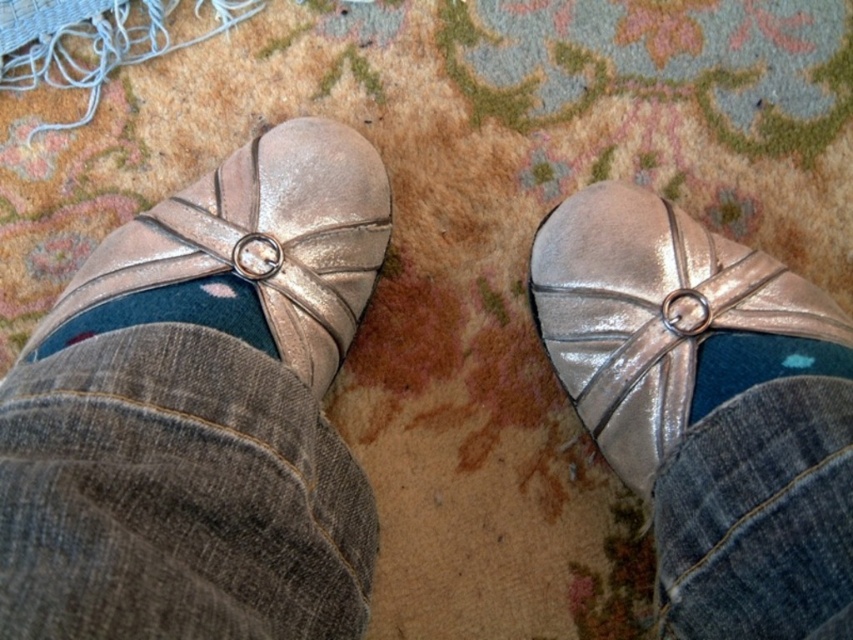
Question: Is shiny metallic shoe at center thinner than metallic leather shoe at left?

Choices:
 (A) no
 (B) yes

Answer: (B)

Question: Which object is the farthest from the blue denim sock at right?

Choices:
 (A) metallic leather shoe at left
 (B) blue soft sock at lower left

Answer: (B)

Question: Observing the image, what is the correct spatial positioning of metallic leather shoe at left in reference to blue denim sock at right?

Choices:
 (A) above
 (B) below

Answer: (A)

Question: Where is metallic leather shoe at left located in relation to blue denim sock at right in the image?

Choices:
 (A) right
 (B) left

Answer: (B)

Question: Which point is farther to the camera?

Choices:
 (A) blue denim sock at right
 (B) blue soft sock at lower left
 (C) metallic leather shoe at left

Answer: (C)

Question: Which of the following is the farthest from the observer?

Choices:
 (A) (761, 332)
 (B) (659, 298)

Answer: (B)